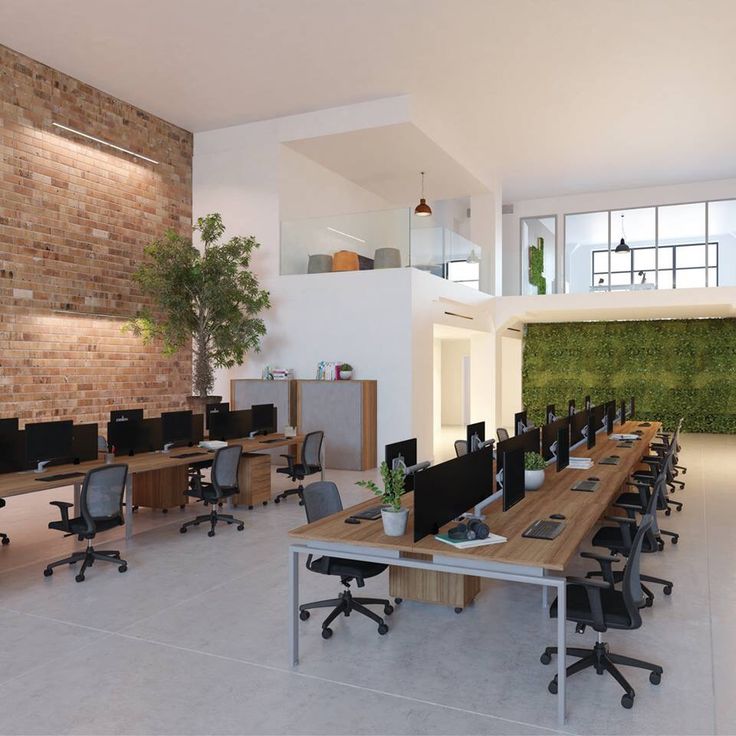
This screenshot has height=736, width=736. I want to click on mouse, so click(x=553, y=514), click(x=595, y=478), click(x=608, y=453), click(x=628, y=442), click(x=640, y=431), click(x=645, y=422), click(x=347, y=523), click(x=291, y=439), click(x=213, y=450).